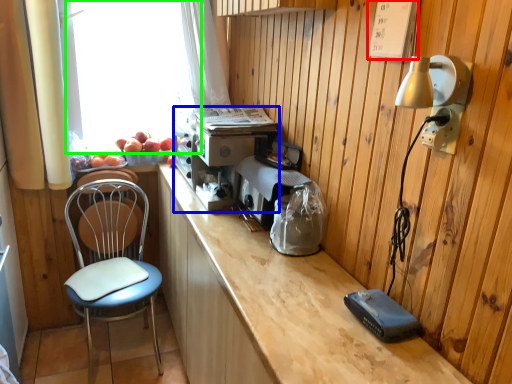
Question: Considering the real-world distances, which object is closest to panel (highlighted by a red box)? coffee machine (highlighted by a blue box) or window screen (highlighted by a green box).

Choices:
 (A) coffee machine
 (B) window screen

Answer: (A)